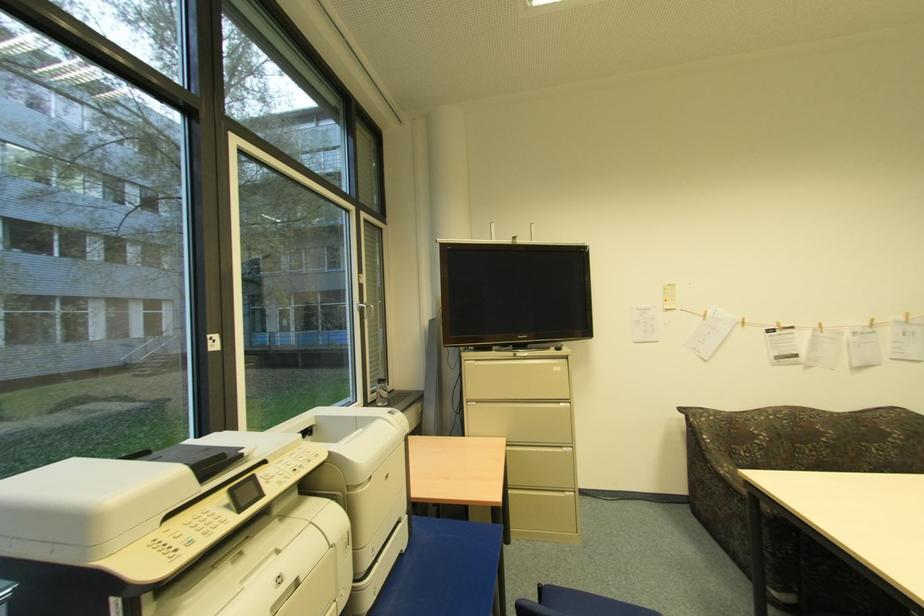
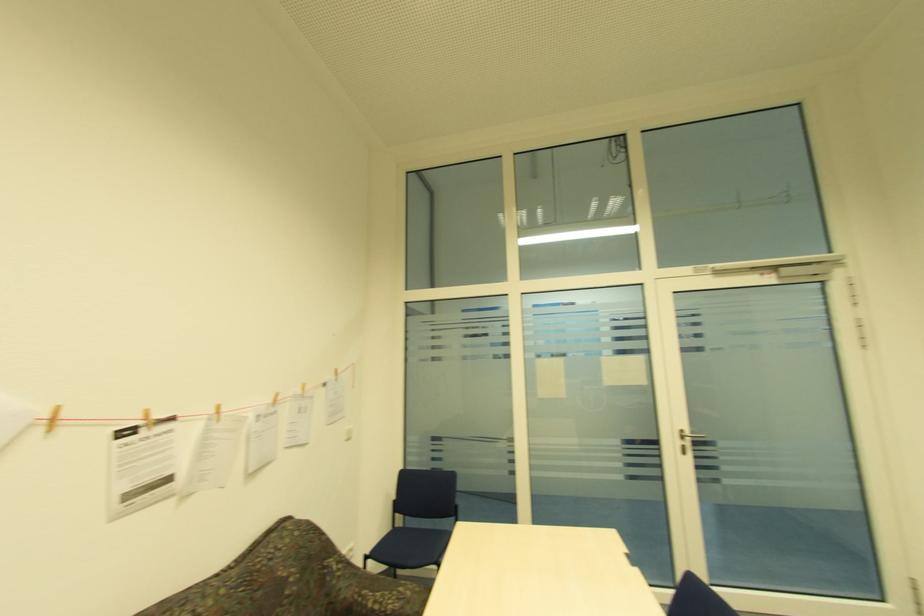
Locate, in the second image, the point that corresponds to pixel 779 325 in the first image.

(141, 416)